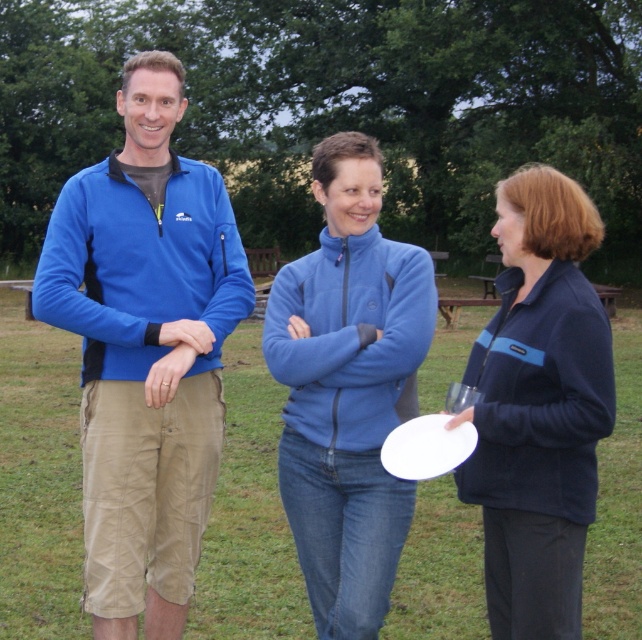
You are a photographer trying to capture a group photo of the matte blue fleece at center and the navy blue fleece at center. Since you want to ensure both are in focus, which one should you focus on first to account for their positions?

You should focus on the matte blue fleece at center first because it is closer to the viewer than the navy blue fleece at center, so adjusting focus from near to far will help both be in focus.

You are a photographer trying to capture a group shot of the matte blue fleece at center and navy blue fleece at center. Since both are wearing blue jackets, how can you distinguish them in the photo based on their positions?

The matte blue fleece at center is positioned on the left side of navy blue fleece at center, so you can distinguish them by noting that the matte blue fleece at center is to the left of the navy blue fleece at center in the photo.